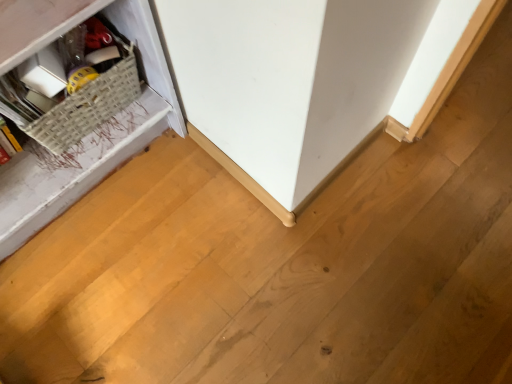
Describe the element at coordinates (76, 88) in the screenshot. Image resolution: width=512 pixels, height=384 pixels. I see `woven beige basket at left` at that location.

What are the coordinates of `woven beige basket at left` in the screenshot? It's located at (76, 88).

You are a GUI agent. You are given a task and a screenshot of the screen. Output one action in this format:
    pyautogui.click(x=<x>, y=<y>)
    Task: Click on the woven beige basket at left
    This screenshot has width=512, height=384.
    Given the screenshot: What is the action you would take?
    pyautogui.click(x=76, y=88)